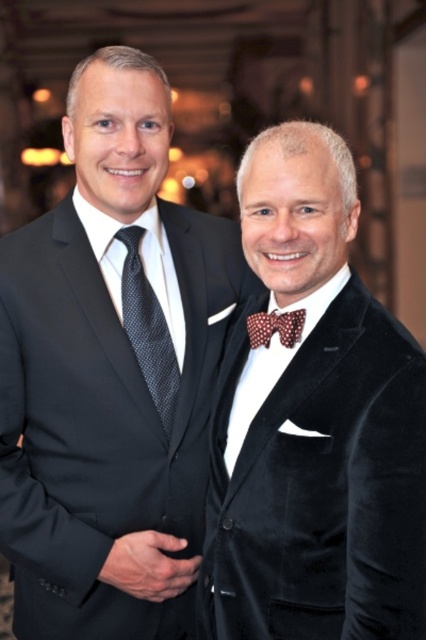
Question: Can you confirm if velvet bow tie at center is positioned to the right of brown dotted bow tie at center?

Choices:
 (A) no
 (B) yes

Answer: (B)

Question: Which point is closer to the camera?

Choices:
 (A) (109, 164)
 (B) (157, 396)

Answer: (A)

Question: Is matte black suit at left bigger than brown dotted bow tie at center?

Choices:
 (A) no
 (B) yes

Answer: (B)

Question: Which object appears farthest from the camera in this image?

Choices:
 (A) brown dotted bow tie at center
 (B) dark gray textured tie at left

Answer: (B)

Question: Which of the following is the farthest from the observer?

Choices:
 (A) (356, 419)
 (B) (92, 508)

Answer: (B)

Question: Can you confirm if matte black suit at left is smaller than brown dotted bow tie at center?

Choices:
 (A) yes
 (B) no

Answer: (B)